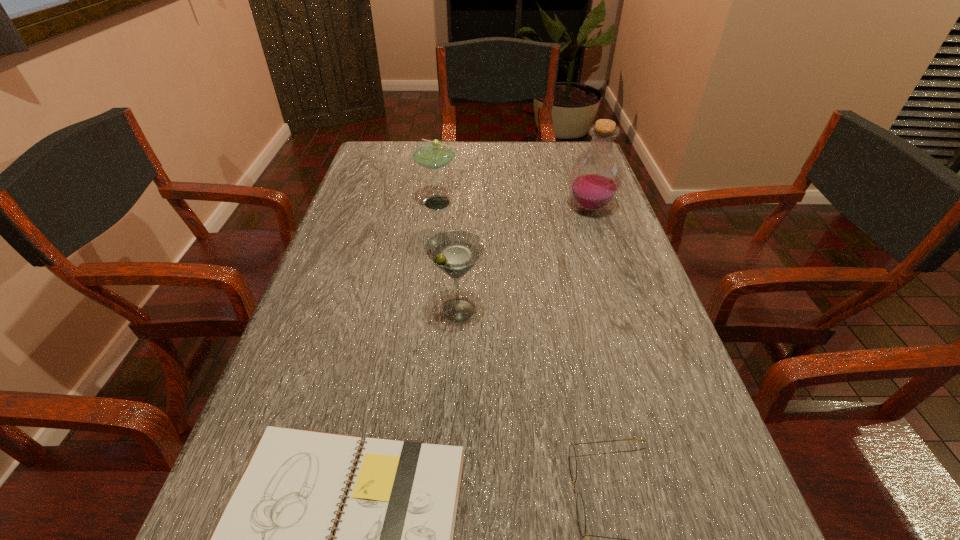
This screenshot has width=960, height=540. I want to click on bottle, so click(596, 176).

Locate an element on the screen. The width and height of the screenshot is (960, 540). the third farthest object is located at coordinates (455, 252).

In order to click on the farther martini in this screenshot , I will do `click(432, 154)`.

Find the location of `vacant position located 0.350m on the front of the tallest object`. vacant position located 0.350m on the front of the tallest object is located at coordinates (628, 320).

The height and width of the screenshot is (540, 960). Identify the location of free space located on the right of the third nearest object. (606, 311).

I want to click on free location located 0.120m on the front of the farther martini, so click(436, 241).

Identify the location of object situated at the right edge. (596, 176).

Where is `vacant region at the far edge of the desktop`? vacant region at the far edge of the desktop is located at coordinates (539, 161).

This screenshot has height=540, width=960. In the image, there is a desktop. What are the coordinates of `vacant space at the left edge` in the screenshot? It's located at (336, 422).

In the image, there is a desktop. Where is `vacant space at the right edge`? vacant space at the right edge is located at coordinates (641, 275).